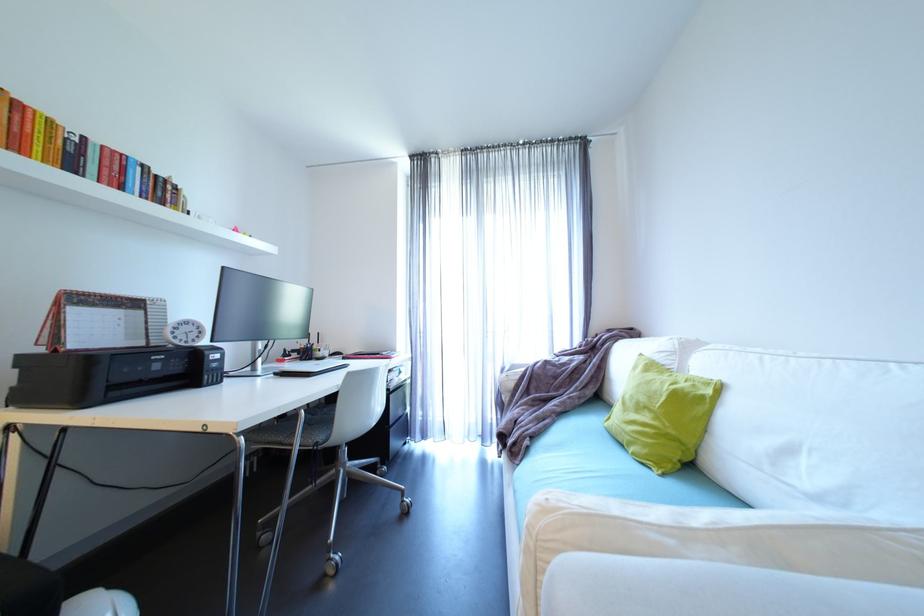
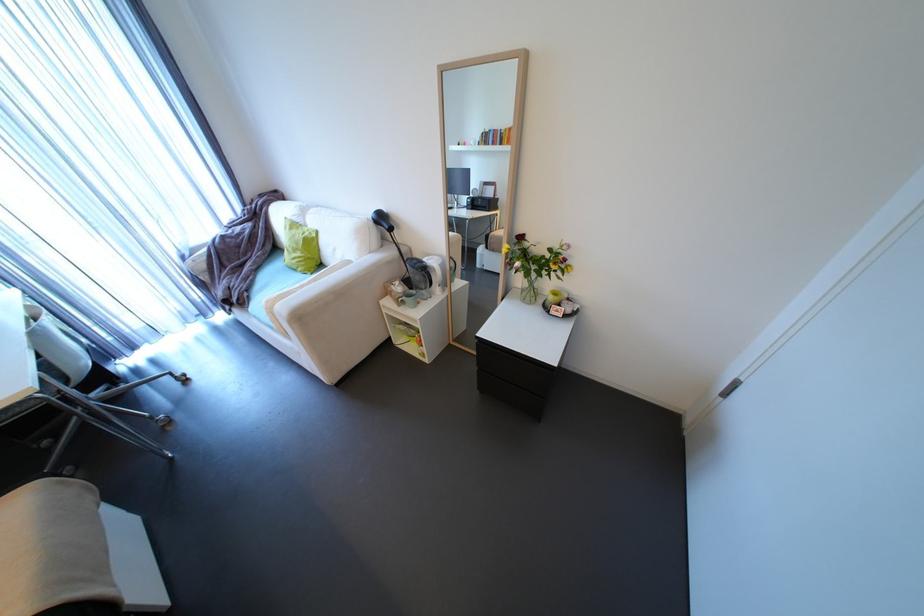
The point at (663, 419) is marked in the first image. Where is the corresponding point in the second image?

(310, 253)